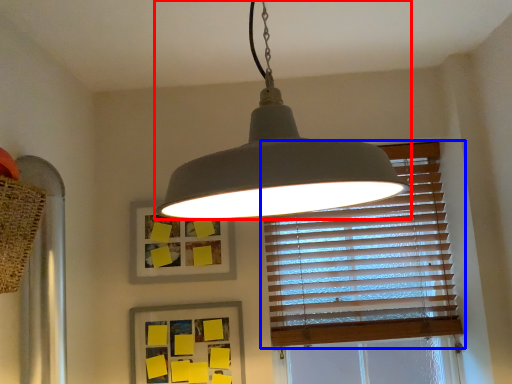
Question: Which point is closer to the camera, lamp (highlighted by a red box) or window blind (highlighted by a blue box)?

Choices:
 (A) lamp
 (B) window blind

Answer: (A)